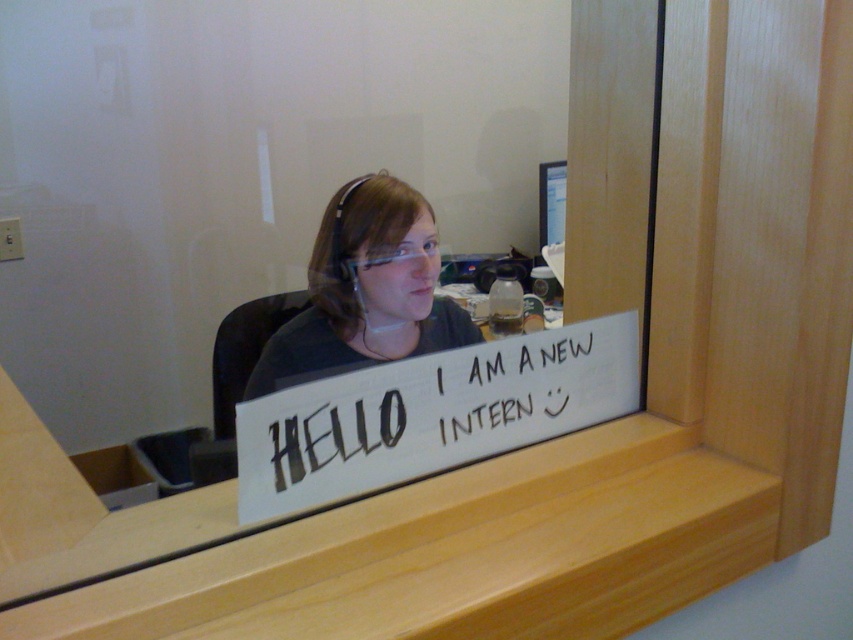
Question: Where is white paper sign at center located in relation to matte black shirt at center in the image?

Choices:
 (A) below
 (B) above

Answer: (A)

Question: Can you confirm if white paper sign at center is wider than matte black shirt at center?

Choices:
 (A) no
 (B) yes

Answer: (A)

Question: Which of the following is the closest to the observer?

Choices:
 (A) clear plastic goggles at center
 (B) white paper sign at center
 (C) matte black shirt at center

Answer: (B)

Question: Among these points, which one is nearest to the camera?

Choices:
 (A) (431, 237)
 (B) (462, 413)

Answer: (B)

Question: Among these objects, which one is nearest to the camera?

Choices:
 (A) white paper sign at center
 (B) matte black shirt at center
 (C) clear plastic goggles at center

Answer: (A)

Question: Can you confirm if white paper sign at center is bigger than clear plastic goggles at center?

Choices:
 (A) no
 (B) yes

Answer: (B)